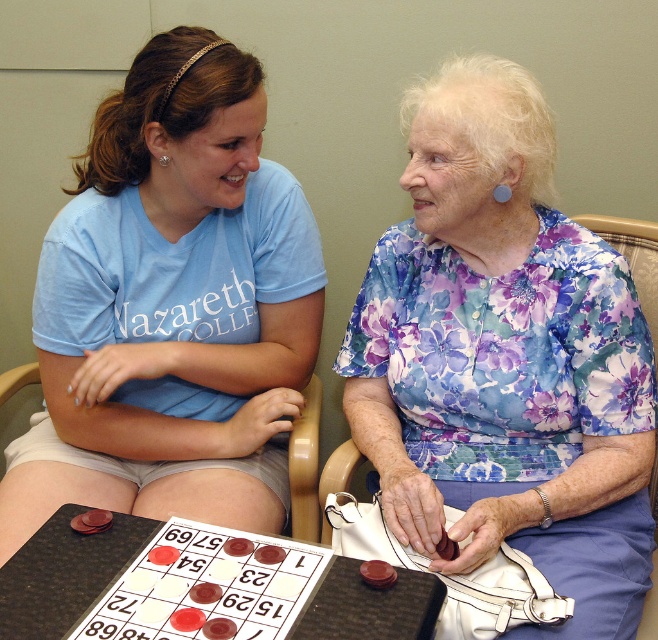
Question: Which point is closer to the camera?

Choices:
 (A) translucent plastic board at center
 (B) wooden chair at center

Answer: (A)

Question: Does floral fabric blouse at center have a lesser width compared to translucent plastic board at center?

Choices:
 (A) yes
 (B) no

Answer: (A)

Question: Among these points, which one is nearest to the camera?

Choices:
 (A) (230, 248)
 (B) (599, 291)

Answer: (B)

Question: Does floral fabric blouse at center lie in front of translucent plastic board at center?

Choices:
 (A) yes
 (B) no

Answer: (B)

Question: Which point is farther to the camera?

Choices:
 (A) (147, 579)
 (B) (34, 369)

Answer: (B)

Question: Does translucent plastic board at center appear on the left side of wooden chair at center?

Choices:
 (A) yes
 (B) no

Answer: (A)